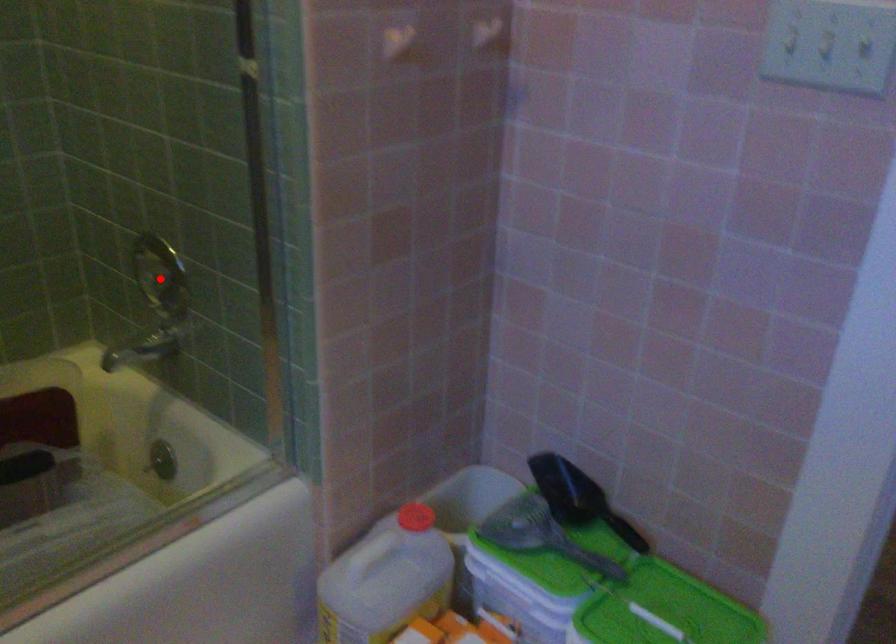
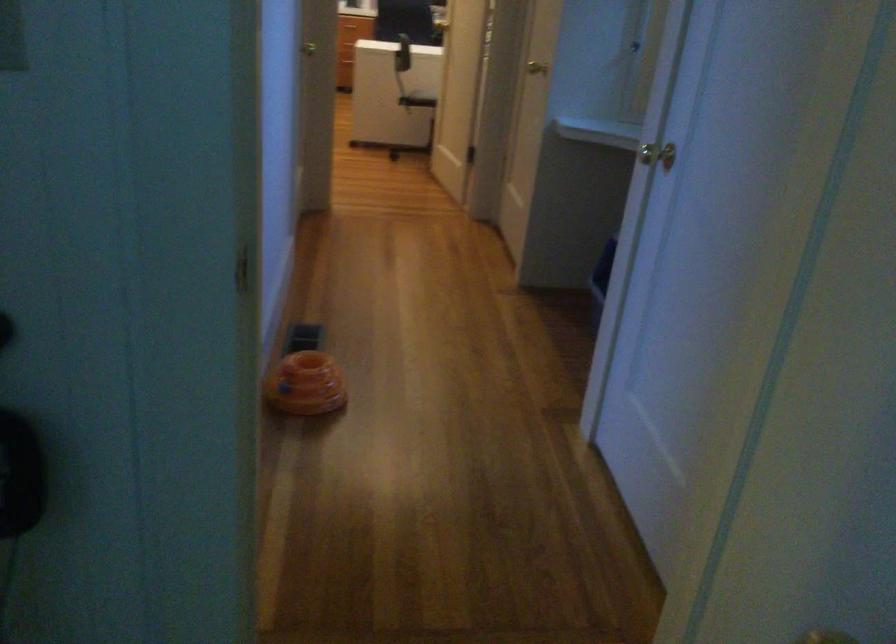
Question: I am providing you with two images of the same scene from different viewpoints. A red point is marked on the first image. Can you still see the location of the red point in image 2?

Choices:
 (A) Yes
 (B) No

Answer: (B)